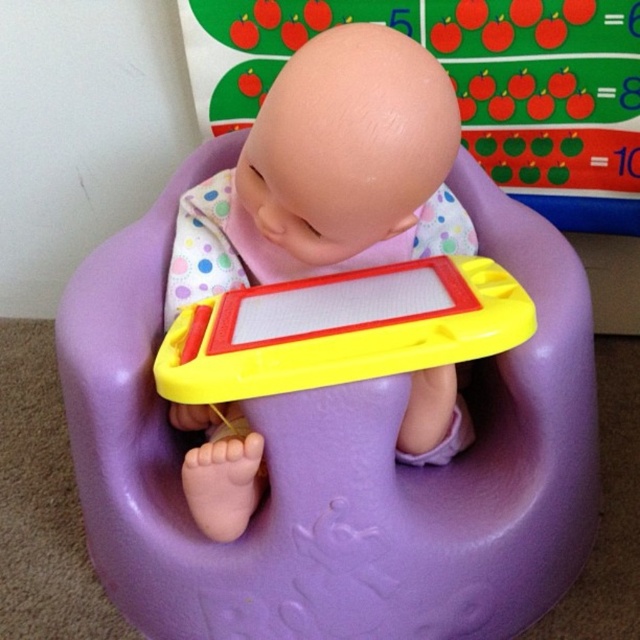
Consider the image. You are a parent holding a baby who needs to reach the purple plastic feeding chair at center. Can the baby reach it if the baby can stretch 70 centimeters?

The distance between the purple plastic feeding chair at center and the viewer is 76.69 centimeters, so the baby cannot reach it with a stretch of only 70 centimeters.